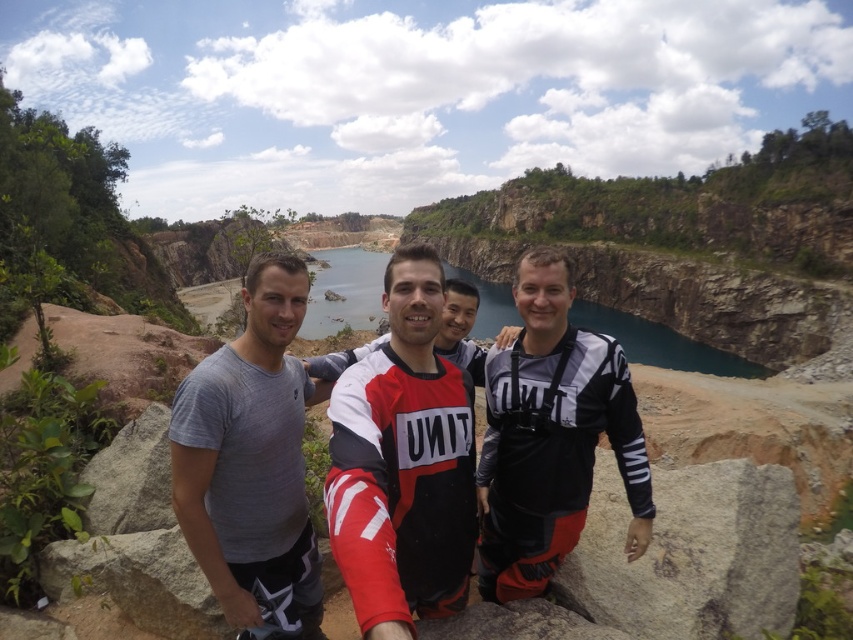
Between red and white jersey at center and gray matte t-shirt at center, which one appears on the right side from the viewer's perspective?

red and white jersey at center is more to the right.

Between point (460, 417) and point (250, 356), which one is positioned in front?

Point (460, 417)

The image size is (853, 640). I want to click on red and white jersey at center, so click(403, 464).

From the picture: Does red and white jersey at center appear over gray rough rock at center?

Correct, red and white jersey at center is located above gray rough rock at center.

This screenshot has width=853, height=640. What do you see at coordinates (403, 464) in the screenshot?
I see `red and white jersey at center` at bounding box center [403, 464].

Image resolution: width=853 pixels, height=640 pixels. I want to click on red and white jersey at center, so click(x=403, y=464).

Consider the image. Can you confirm if red and white jersey at center is wider than black matte wetsuit at center?

No.

Does point (457, 380) come in front of point (515, 544)?

No, (457, 380) is further to viewer.

The image size is (853, 640). What do you see at coordinates (403, 464) in the screenshot?
I see `red and white jersey at center` at bounding box center [403, 464].

Where is `red and white jersey at center`? The width and height of the screenshot is (853, 640). red and white jersey at center is located at coordinates (403, 464).